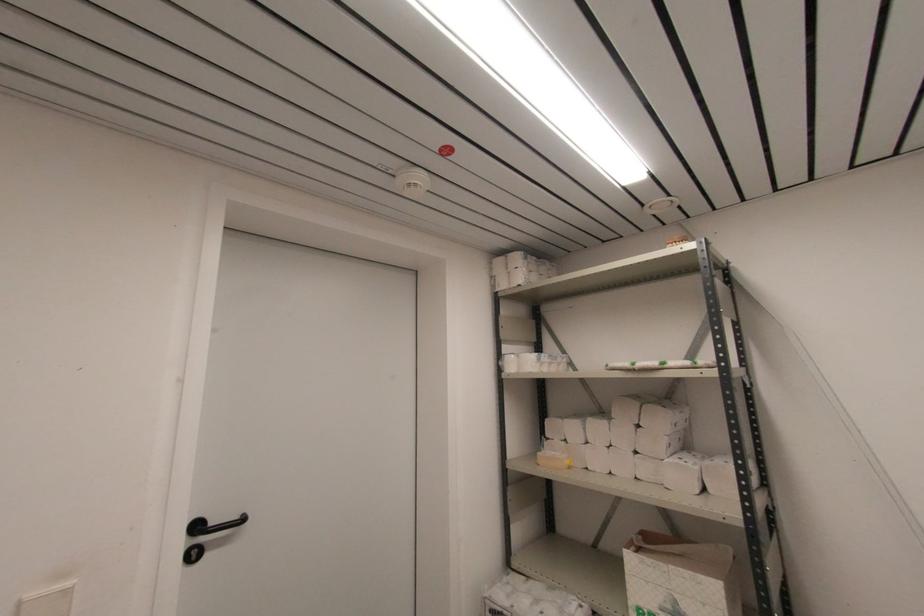
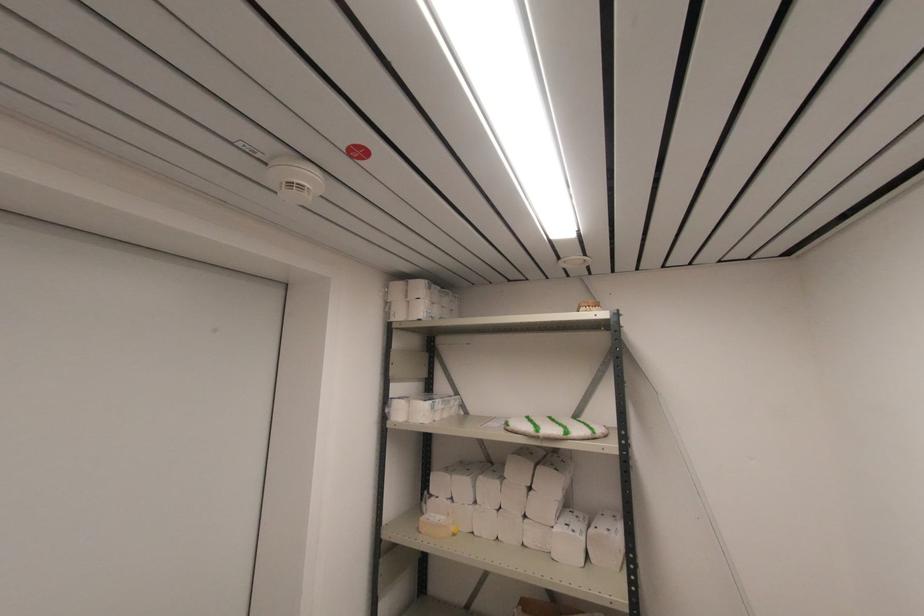
Locate, in the second image, the point that corresponds to (x=633, y=368) in the first image.

(537, 436)